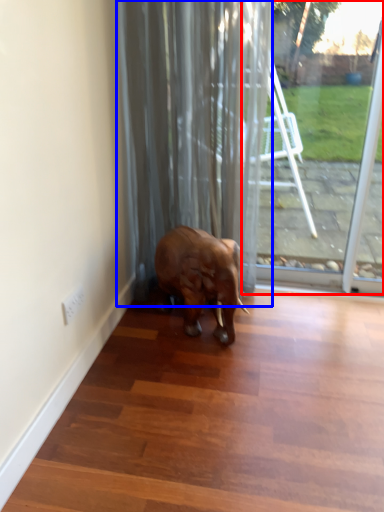
Question: Which point is further to the camera, glass door (highlighted by a red box) or curtain (highlighted by a blue box)?

Choices:
 (A) glass door
 (B) curtain

Answer: (A)